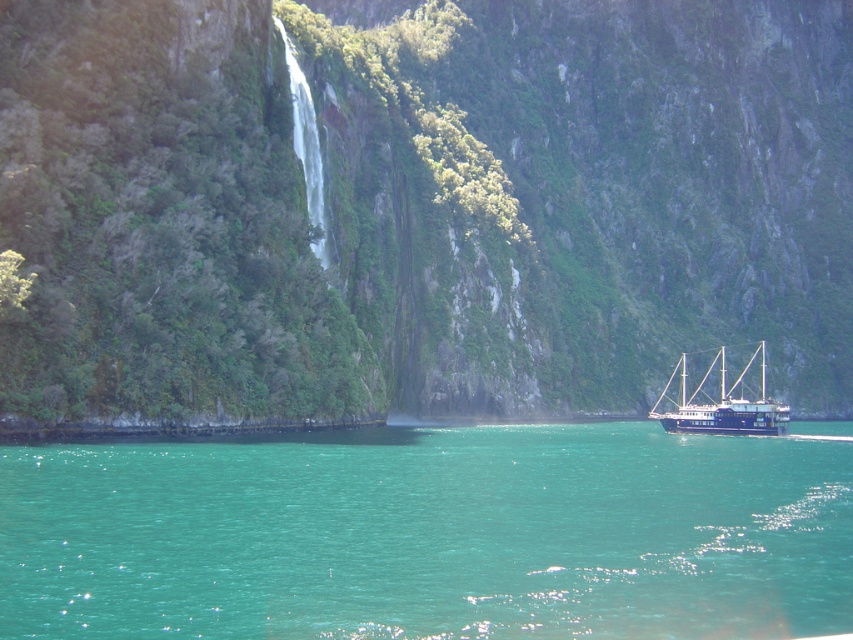
At what (x,y) coordinates should I click in order to perform the action: click on green mossy cliff at center. Please return your answer as a coordinate pair (x, y). Image resolution: width=853 pixels, height=640 pixels. Looking at the image, I should click on (421, 204).

Consider the image. Between green mossy cliff at center and dark blue wooden ship at lower right, which one has less height?

dark blue wooden ship at lower right

Does point (148, 305) come closer to viewer compared to point (701, 429)?

Yes, point (148, 305) is in front of point (701, 429).

At what (x,y) coordinates should I click in order to perform the action: click on green mossy cliff at center. Please return your answer as a coordinate pair (x, y). Image resolution: width=853 pixels, height=640 pixels. Looking at the image, I should click on (421, 204).

Which of these two, green mossy cliff at center or teal glossy water at center, stands shorter?

teal glossy water at center

Can you confirm if green mossy cliff at center is taller than teal glossy water at center?

Indeed, green mossy cliff at center has a greater height compared to teal glossy water at center.

Does point (61, 237) come closer to viewer compared to point (126, 465)?

No, it is behind (126, 465).

The image size is (853, 640). Find the location of `green mossy cliff at center`. green mossy cliff at center is located at coordinates (421, 204).

Can you confirm if teal glossy water at center is wider than dark blue wooden ship at lower right?

Correct, the width of teal glossy water at center exceeds that of dark blue wooden ship at lower right.

Does teal glossy water at center have a greater height compared to dark blue wooden ship at lower right?

No.

Identify the location of teal glossy water at center. The width and height of the screenshot is (853, 640). (428, 536).